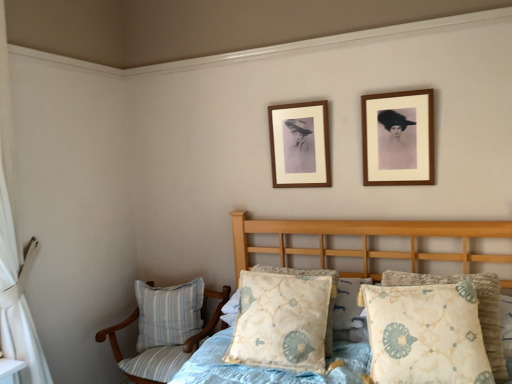
Question: Can you confirm if striped fabric chair at lower left is shorter than fluffy fabric bed at lower right?

Choices:
 (A) yes
 (B) no

Answer: (A)

Question: Is striped fabric chair at lower left turned away from fluffy fabric bed at lower right?

Choices:
 (A) yes
 (B) no

Answer: (B)

Question: Can you confirm if striped fabric chair at lower left is thinner than fluffy fabric bed at lower right?

Choices:
 (A) yes
 (B) no

Answer: (A)

Question: Does striped fabric chair at lower left come behind fluffy fabric bed at lower right?

Choices:
 (A) no
 (B) yes

Answer: (B)

Question: From the image's perspective, is striped fabric chair at lower left under fluffy fabric bed at lower right?

Choices:
 (A) yes
 (B) no

Answer: (A)

Question: From a real-world perspective, is floral-patterned fabric pillow at center, positioned as the 2th pillow in front-to-back order, above or below wooden picture frame at upper right, placed as the second picture frame when sorted from back to front?

Choices:
 (A) above
 (B) below

Answer: (B)

Question: Looking at the image, does floral-patterned fabric pillow at center, acting as the second pillow starting from the right, seem bigger or smaller compared to wooden picture frame at upper right, which is the second picture frame from left to right?

Choices:
 (A) big
 (B) small

Answer: (A)

Question: From their relative heights in the image, would you say floral-patterned fabric pillow at center, acting as the second pillow starting from the right, is taller or shorter than wooden picture frame at upper right, positioned as the 1th picture frame in front-to-back order?

Choices:
 (A) tall
 (B) short

Answer: (B)

Question: From the image's perspective, relative to wooden picture frame at upper right, the 1th picture frame when ordered from right to left, is floral-patterned fabric pillow at center, the second pillow positioned from the left, above or below?

Choices:
 (A) above
 (B) below

Answer: (B)

Question: Is wooden picture frame at upper right, placed as the second picture frame when sorted from back to front, bigger or smaller than fluffy fabric bed at lower right?

Choices:
 (A) big
 (B) small

Answer: (B)

Question: Relative to fluffy fabric bed at lower right, is wooden picture frame at upper right, placed as the second picture frame when sorted from back to front, in front or behind?

Choices:
 (A) front
 (B) behind

Answer: (B)

Question: Considering the positions of wooden picture frame at upper right, the 1th picture frame when ordered from right to left, and fluffy fabric bed at lower right in the image, is wooden picture frame at upper right, the 1th picture frame when ordered from right to left, taller or shorter than fluffy fabric bed at lower right?

Choices:
 (A) tall
 (B) short

Answer: (B)

Question: Which is correct: wooden picture frame at upper right, positioned as the 1th picture frame in front-to-back order, is inside fluffy fabric bed at lower right, or outside of it?

Choices:
 (A) outside
 (B) inside

Answer: (A)

Question: From a real-world perspective, relative to floral-patterned fabric pillow at center, positioned as the 2th pillow in front-to-back order, is fluffy fabric bed at lower right vertically above or below?

Choices:
 (A) below
 (B) above

Answer: (A)

Question: Is point (233, 238) positioned closer to the camera than point (239, 352)?

Choices:
 (A) farther
 (B) closer

Answer: (A)